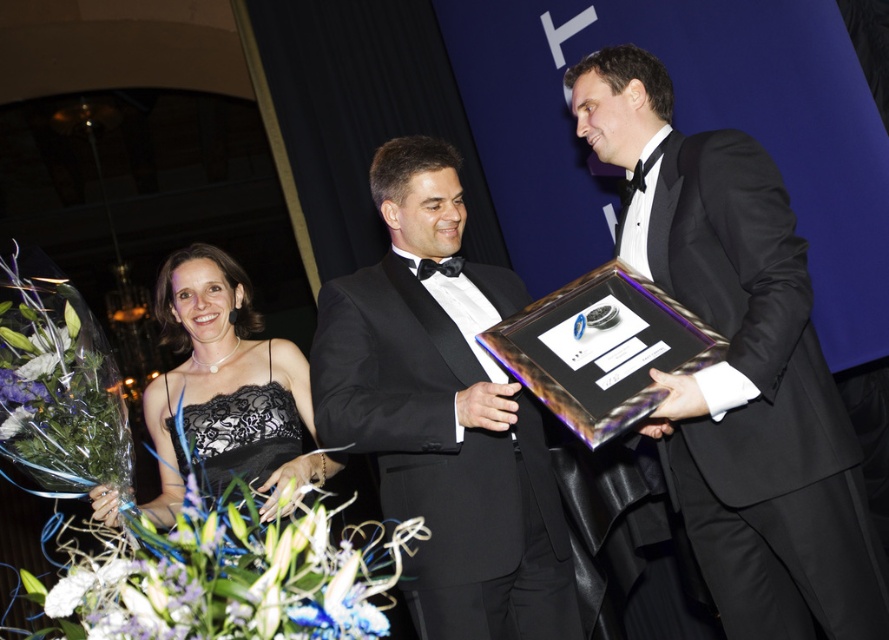
Which is behind, point (687, 234) or point (255, 461)?

The point (255, 461) is behind.

Who is shorter, shiny black tuxedo at center or black lace dress at lower left?

black lace dress at lower left

Which is in front, point (723, 595) or point (247, 292)?

Point (723, 595)

Where is `shiny black tuxedo at center`? shiny black tuxedo at center is located at coordinates tap(741, 365).

Can you confirm if black satin tuxedo at center is positioned to the left of black lace cocktail dress at center?

No, black satin tuxedo at center is not to the left of black lace cocktail dress at center.

Can you confirm if black satin tuxedo at center is wider than black lace cocktail dress at center?

Yes, black satin tuxedo at center is wider than black lace cocktail dress at center.

Which is behind, point (482, 321) or point (287, 401)?

Positioned behind is point (287, 401).

You are a GUI agent. You are given a task and a screenshot of the screen. Output one action in this format:
    pyautogui.click(x=<x>, y=<y>)
    Task: Click on the black satin tuxedo at center
    Image resolution: width=889 pixels, height=640 pixels.
    Given the screenshot: What is the action you would take?
    pyautogui.click(x=444, y=412)

Does shiny black tuxedo at center have a larger size compared to black satin tuxedo at center?

Yes.

Describe the element at coordinates (741, 365) in the screenshot. I see `shiny black tuxedo at center` at that location.

Where is `shiny black tuxedo at center`? shiny black tuxedo at center is located at coordinates (741, 365).